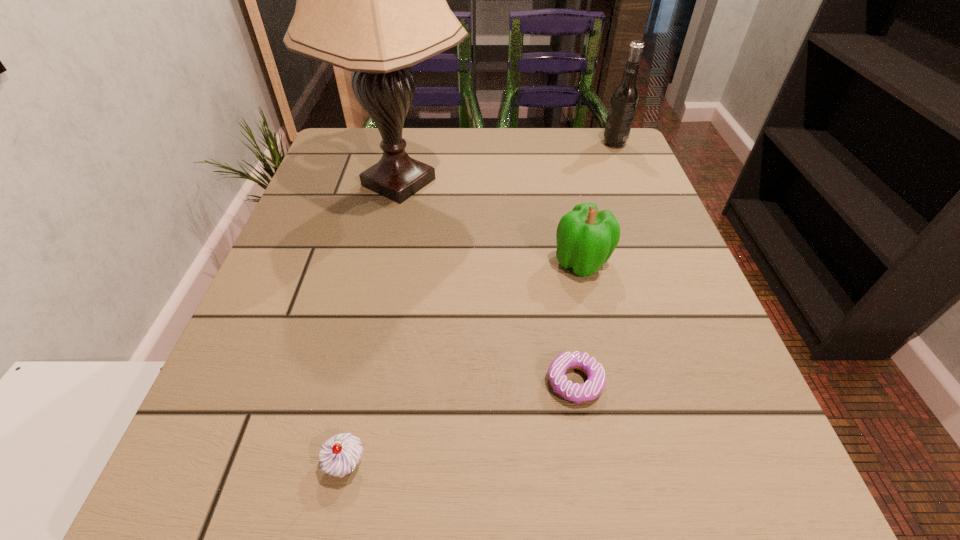
Locate an element on the screen. free location that satisfies the following two spatial constraints: 1. on the front side of the third tallest object; 2. on the left side of the tallest object is located at coordinates (381, 262).

Where is `vacant space that satisfies the following two spatial constraints: 1. on the label of the root beer; 2. on the front side of the lamp`? The width and height of the screenshot is (960, 540). vacant space that satisfies the following two spatial constraints: 1. on the label of the root beer; 2. on the front side of the lamp is located at coordinates (631, 183).